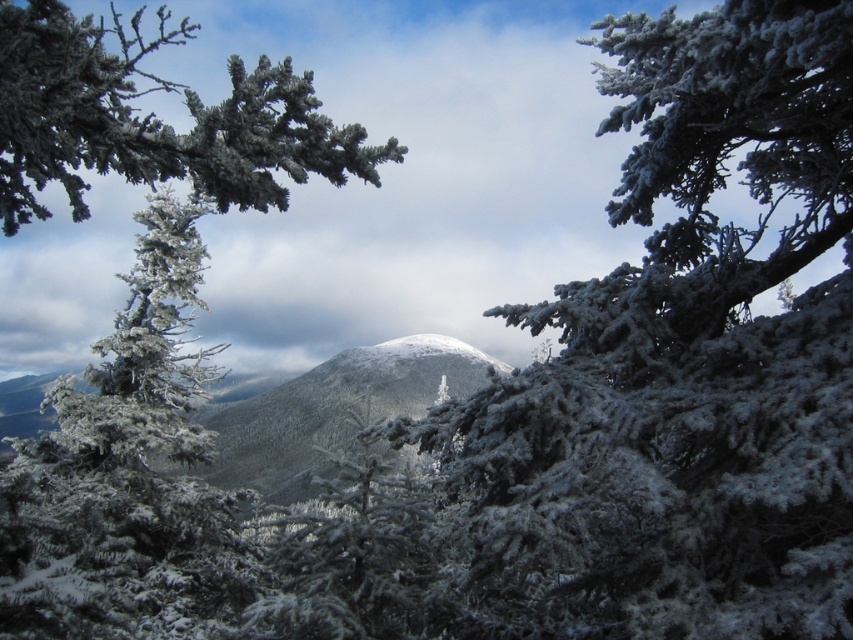
Does frosted pine branch at upper left lie in front of white frosty mountain at center?

Yes.

Is frosted pine branch at upper left further to camera compared to white frosty mountain at center?

That is False.

Where is `frosted pine branch at upper left`? The image size is (853, 640). frosted pine branch at upper left is located at coordinates (154, 120).

Is frosted pine tree at center to the right of frosted pine branch at upper left from the viewer's perspective?

Yes, frosted pine tree at center is to the right of frosted pine branch at upper left.

Can you confirm if frosted pine tree at center is smaller than frosted pine branch at upper left?

Result: Yes.

Between point (186, 275) and point (36, 19), which one is positioned in front?

Point (36, 19) is in front.

Identify the location of frosted pine tree at center. (126, 474).

Who is higher up, frosted pine tree at center or white frosty mountain at center?

frosted pine tree at center

Is point (135, 218) less distant than point (202, 416)?

Yes, it is.

Image resolution: width=853 pixels, height=640 pixels. What are the coordinates of `frosted pine tree at center` in the screenshot? It's located at (126, 474).